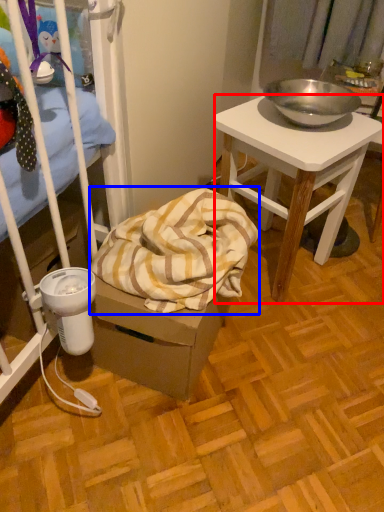
Question: Which object appears closest to the camera in this image, desk (highlighted by a red box) or blanket (highlighted by a blue box)?

Choices:
 (A) desk
 (B) blanket

Answer: (B)